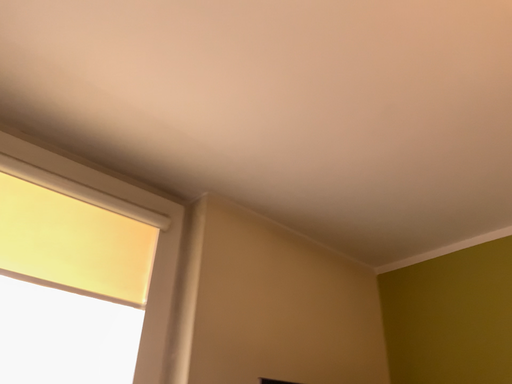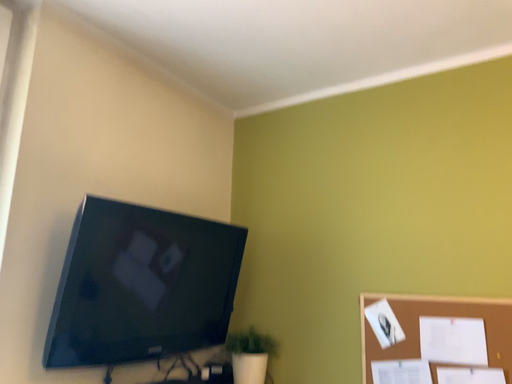
Question: How did the camera likely rotate when shooting the video?

Choices:
 (A) rotated left
 (B) rotated right

Answer: (B)